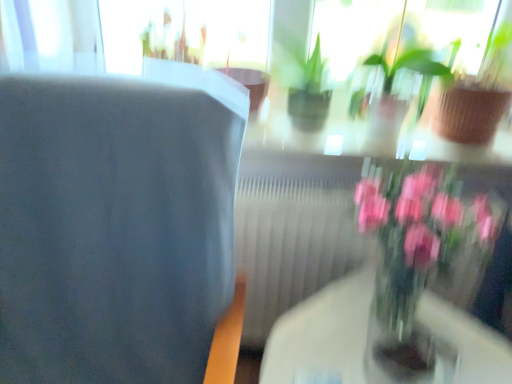
Question: Should I look upward or downward to see pink glass vase at right?

Choices:
 (A) down
 (B) up

Answer: (A)

Question: From the image's perspective, is blue fabric chair at left under green glossy houseplant at upper center, the 1th houseplant positioned from the left?

Choices:
 (A) no
 (B) yes

Answer: (B)

Question: Is blue fabric chair at left not near green glossy houseplant at upper center, the 1th houseplant positioned from the left?

Choices:
 (A) no
 (B) yes

Answer: (A)

Question: Does blue fabric chair at left appear on the left side of green glossy houseplant at upper center, which is counted as the 2th houseplant, starting from the right?

Choices:
 (A) no
 (B) yes

Answer: (B)

Question: Could you tell me if blue fabric chair at left is facing green glossy houseplant at upper center, which is counted as the 2th houseplant, starting from the right?

Choices:
 (A) yes
 (B) no

Answer: (B)

Question: Considering the relative sizes of blue fabric chair at left and green glossy houseplant at upper center, which is counted as the 2th houseplant, starting from the right, in the image provided, is blue fabric chair at left smaller than green glossy houseplant at upper center, which is counted as the 2th houseplant, starting from the right,?

Choices:
 (A) yes
 (B) no

Answer: (B)

Question: Is blue fabric chair at left with green glossy houseplant at upper center, which is counted as the 2th houseplant, starting from the right?

Choices:
 (A) yes
 (B) no

Answer: (B)

Question: Is pink glass vase at right not inside blue fabric chair at left?

Choices:
 (A) no
 (B) yes

Answer: (B)

Question: Is pink glass vase at right not near blue fabric chair at left?

Choices:
 (A) no
 (B) yes

Answer: (A)

Question: Is pink glass vase at right bigger than blue fabric chair at left?

Choices:
 (A) yes
 (B) no

Answer: (B)

Question: From a real-world perspective, is pink glass vase at right over blue fabric chair at left?

Choices:
 (A) yes
 (B) no

Answer: (A)

Question: Is pink glass vase at right with blue fabric chair at left?

Choices:
 (A) no
 (B) yes

Answer: (A)

Question: Is pink glass vase at right smaller than blue fabric chair at left?

Choices:
 (A) no
 (B) yes

Answer: (B)

Question: Considering the relative positions of pink glass vase at right and green glossy houseplant at upper center, which is counted as the 2th houseplant, starting from the right, in the image provided, is pink glass vase at right in front of green glossy houseplant at upper center, which is counted as the 2th houseplant, starting from the right,?

Choices:
 (A) yes
 (B) no

Answer: (A)